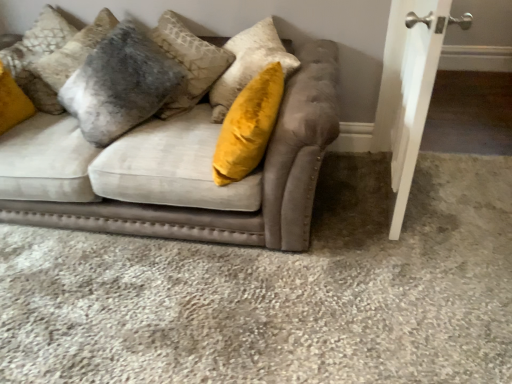
Question: Should I look upward or downward to see velvet gray pillow at upper left?

Choices:
 (A) up
 (B) down

Answer: (A)

Question: Does velvet gray pillow at upper left have a lesser width compared to velvet beige couch at center?

Choices:
 (A) no
 (B) yes

Answer: (B)

Question: Is velvet gray pillow at upper left next to velvet beige couch at center?

Choices:
 (A) yes
 (B) no

Answer: (B)

Question: Could you tell me if velvet gray pillow at upper left is turned towards velvet beige couch at center?

Choices:
 (A) no
 (B) yes

Answer: (B)

Question: Is velvet gray pillow at upper left behind velvet beige couch at center?

Choices:
 (A) no
 (B) yes

Answer: (B)

Question: Is velvet gray pillow at upper left smaller than velvet beige couch at center?

Choices:
 (A) no
 (B) yes

Answer: (B)

Question: From the image's perspective, is velvet gray pillow at upper left located beneath velvet beige couch at center?

Choices:
 (A) yes
 (B) no

Answer: (B)

Question: From the image's perspective, is velvet beige couch at center beneath velvet gray pillow at upper left?

Choices:
 (A) no
 (B) yes

Answer: (B)

Question: Would you say velvet gray pillow at upper left is part of velvet beige couch at center's contents?

Choices:
 (A) no
 (B) yes

Answer: (B)

Question: Can you confirm if velvet beige couch at center is bigger than velvet gray pillow at upper left?

Choices:
 (A) yes
 (B) no

Answer: (A)

Question: From the image's perspective, does velvet beige couch at center appear higher than velvet gray pillow at upper left?

Choices:
 (A) yes
 (B) no

Answer: (B)

Question: Is velvet beige couch at center not near velvet gray pillow at upper left?

Choices:
 (A) no
 (B) yes

Answer: (A)

Question: Can you confirm if velvet beige couch at center is positioned to the right of velvet gray pillow at upper left?

Choices:
 (A) yes
 (B) no

Answer: (A)

Question: From a real-world perspective, does white smooth door at right stand above velvet gray pillow at upper left?

Choices:
 (A) yes
 (B) no

Answer: (B)